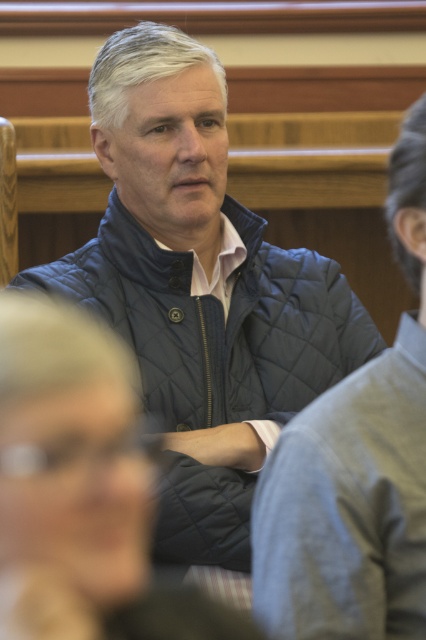
Does quilted blue jacket at center appear under quilted navy jacket at center?

Correct, quilted blue jacket at center is located below quilted navy jacket at center.

Does quilted blue jacket at center have a larger size compared to quilted navy jacket at center?

Actually, quilted blue jacket at center might be smaller than quilted navy jacket at center.

Which is behind, point (101, 403) or point (273, 620)?

Positioned behind is point (273, 620).

You are a GUI agent. You are given a task and a screenshot of the screen. Output one action in this format:
    pyautogui.click(x=<x>, y=<y>)
    Task: Click on the quilted blue jacket at center
    
    Given the screenshot: What is the action you would take?
    pyautogui.click(x=83, y=484)